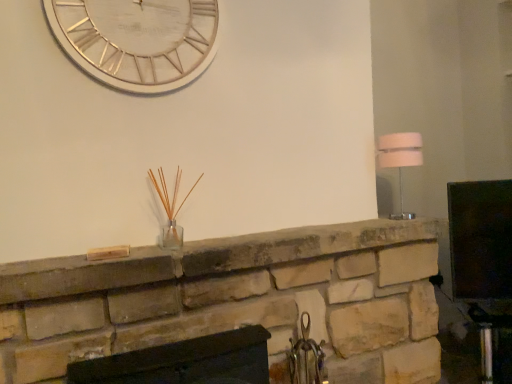
The height and width of the screenshot is (384, 512). I want to click on white fabric lampshade at right, so click(400, 160).

Considering the relative sizes of matte black fireplace at center, the second fireplace positioned from the top, and white fabric lampshade at right in the image provided, is matte black fireplace at center, the second fireplace positioned from the top, smaller than white fabric lampshade at right?

Incorrect, matte black fireplace at center, the second fireplace positioned from the top, is not smaller in size than white fabric lampshade at right.

From the image's perspective, would you say matte black fireplace at center, positioned as the 1th fireplace in bottom-to-top order, is positioned over white fabric lampshade at right?

No, from the image's perspective, matte black fireplace at center, positioned as the 1th fireplace in bottom-to-top order, is not on top of white fabric lampshade at right.

Is matte black fireplace at center, the second fireplace positioned from the top, spatially inside white fabric lampshade at right, or outside of it?

matte black fireplace at center, the second fireplace positioned from the top, lies outside white fabric lampshade at right.

Between matte black fireplace at center, the second fireplace positioned from the top, and natural stone fireplace at center, which is the 2th fireplace in bottom-to-top order, which one has smaller size?

matte black fireplace at center, the second fireplace positioned from the top, is smaller.

From their relative heights in the image, would you say matte black fireplace at center, the second fireplace positioned from the top, is taller or shorter than natural stone fireplace at center, which is the 2th fireplace in bottom-to-top order?

matte black fireplace at center, the second fireplace positioned from the top, is taller than natural stone fireplace at center, which is the 2th fireplace in bottom-to-top order.

Looking at this image, which is correct: matte black fireplace at center, the second fireplace positioned from the top, is inside natural stone fireplace at center, arranged as the 1th fireplace when viewed from the top, or outside of it?

matte black fireplace at center, the second fireplace positioned from the top, lies outside natural stone fireplace at center, arranged as the 1th fireplace when viewed from the top.

Between matte black fireplace at center, positioned as the 1th fireplace in bottom-to-top order, and natural stone fireplace at center, arranged as the 1th fireplace when viewed from the top, which one has smaller width?

Thinner between the two is matte black fireplace at center, positioned as the 1th fireplace in bottom-to-top order.

In terms of width, does white metallic clock at upper center look wider or thinner when compared to white fabric lampshade at right?

Considering their sizes, white metallic clock at upper center looks slimmer than white fabric lampshade at right.

Does white metallic clock at upper center appear on the right side of white fabric lampshade at right?

In fact, white metallic clock at upper center is to the left of white fabric lampshade at right.

Looking at this image, does white metallic clock at upper center contain white fabric lampshade at right?

No.

From a real-world perspective, which is physically above, white metallic clock at upper center or white fabric lampshade at right?

In real-world perspective, white metallic clock at upper center is above.

From a real-world perspective, does white metallic clock at upper center sit lower than matte black fireplace at center, positioned as the 1th fireplace in bottom-to-top order?

No, from a real-world perspective, white metallic clock at upper center is not under matte black fireplace at center, positioned as the 1th fireplace in bottom-to-top order.

From the image's perspective, which is below, white metallic clock at upper center or matte black fireplace at center, positioned as the 1th fireplace in bottom-to-top order?

matte black fireplace at center, positioned as the 1th fireplace in bottom-to-top order, appears lower in the image.

Would you say white metallic clock at upper center is to the left or to the right of matte black fireplace at center, the second fireplace positioned from the top, in the picture?

Based on their positions, white metallic clock at upper center is located to the left of matte black fireplace at center, the second fireplace positioned from the top.

Is the position of white metallic clock at upper center more distant than that of matte black fireplace at center, the second fireplace positioned from the top?

Yes, white metallic clock at upper center is further from the camera.

Who is shorter, white metallic clock at upper center or natural stone fireplace at center, arranged as the 1th fireplace when viewed from the top?

natural stone fireplace at center, arranged as the 1th fireplace when viewed from the top, is shorter.

From the image's perspective, count 1st fireplaces downward from the white metallic clock at upper center and point to it. Please provide its 2D coordinates.

[(234, 300)]

Consider the image. From the image's perspective, is white metallic clock at upper center over natural stone fireplace at center, which is the 2th fireplace in bottom-to-top order?

Indeed, from the image's perspective, white metallic clock at upper center is shown above natural stone fireplace at center, which is the 2th fireplace in bottom-to-top order.

Is white metallic clock at upper center next to natural stone fireplace at center, arranged as the 1th fireplace when viewed from the top, and touching it?

No, white metallic clock at upper center is not beside natural stone fireplace at center, arranged as the 1th fireplace when viewed from the top.

Can you confirm if white fabric lampshade at right is positioned to the right of matte black fireplace at center, the second fireplace positioned from the top?

Correct, you'll find white fabric lampshade at right to the right of matte black fireplace at center, the second fireplace positioned from the top.

Can you confirm if white fabric lampshade at right is smaller than matte black fireplace at center, the second fireplace positioned from the top?

Yes, white fabric lampshade at right is smaller than matte black fireplace at center, the second fireplace positioned from the top.

From a real-world perspective, between white fabric lampshade at right and matte black fireplace at center, positioned as the 1th fireplace in bottom-to-top order, who is vertically lower?

From a 3D spatial view, matte black fireplace at center, positioned as the 1th fireplace in bottom-to-top order, is below.

In the image, is white fabric lampshade at right positioned in front of or behind matte black fireplace at center, positioned as the 1th fireplace in bottom-to-top order?

Visually, white fabric lampshade at right is located behind matte black fireplace at center, positioned as the 1th fireplace in bottom-to-top order.

Is the position of white fabric lampshade at right more distant than that of white metallic clock at upper center?

Yes, white fabric lampshade at right is behind white metallic clock at upper center.

Can you confirm if white fabric lampshade at right is shorter than white metallic clock at upper center?

Correct, white fabric lampshade at right is not as tall as white metallic clock at upper center.

Is white fabric lampshade at right positioned with its back to white metallic clock at upper center?

No.

From the image's perspective, count 2nd fireplaces downward from the white fabric lampshade at right and point to it. Please provide its 2D coordinates.

[(184, 362)]

At what (x,y) coordinates should I click in order to perform the action: click on fireplace above the matte black fireplace at center, the second fireplace positioned from the top (from a real-world perspective). Please return your answer as a coordinate pair (x, y). The image size is (512, 384). Looking at the image, I should click on (234, 300).

Looking at the image, which one is located closer to white fabric lampshade at right, white metallic clock at upper center or natural stone fireplace at center, which is the 2th fireplace in bottom-to-top order?

natural stone fireplace at center, which is the 2th fireplace in bottom-to-top order.

Which object lies further to the anchor point natural stone fireplace at center, arranged as the 1th fireplace when viewed from the top, white fabric lampshade at right or white metallic clock at upper center?

Among the two, white metallic clock at upper center is located further to natural stone fireplace at center, arranged as the 1th fireplace when viewed from the top.

Looking at the image, which one is located closer to white fabric lampshade at right, natural stone fireplace at center, which is the 2th fireplace in bottom-to-top order, or white metallic clock at upper center?

The object closer to white fabric lampshade at right is natural stone fireplace at center, which is the 2th fireplace in bottom-to-top order.

From the picture: Which object lies further to the anchor point natural stone fireplace at center, which is the 2th fireplace in bottom-to-top order, matte black fireplace at center, the second fireplace positioned from the top, or white fabric lampshade at right?

The object further to natural stone fireplace at center, which is the 2th fireplace in bottom-to-top order, is white fabric lampshade at right.

Which object lies further to the anchor point matte black fireplace at center, positioned as the 1th fireplace in bottom-to-top order, white metallic clock at upper center or white fabric lampshade at right?

Among the two, white fabric lampshade at right is located further to matte black fireplace at center, positioned as the 1th fireplace in bottom-to-top order.

From the image, which object appears to be nearer to white metallic clock at upper center, natural stone fireplace at center, arranged as the 1th fireplace when viewed from the top, or white fabric lampshade at right?

natural stone fireplace at center, arranged as the 1th fireplace when viewed from the top.

In the scene shown: Based on their spatial positions, is white fabric lampshade at right or matte black fireplace at center, the second fireplace positioned from the top, closer to natural stone fireplace at center, which is the 2th fireplace in bottom-to-top order?

matte black fireplace at center, the second fireplace positioned from the top, is closer to natural stone fireplace at center, which is the 2th fireplace in bottom-to-top order.

From the image, which object appears to be farther from natural stone fireplace at center, arranged as the 1th fireplace when viewed from the top, white metallic clock at upper center or matte black fireplace at center, positioned as the 1th fireplace in bottom-to-top order?

Based on the image, white metallic clock at upper center appears to be further to natural stone fireplace at center, arranged as the 1th fireplace when viewed from the top.

I want to click on fireplace between matte black fireplace at center, the second fireplace positioned from the top, and white fabric lampshade at right from left to right, so click(234, 300).

The image size is (512, 384). I want to click on fireplace between white metallic clock at upper center and matte black fireplace at center, positioned as the 1th fireplace in bottom-to-top order, in the vertical direction, so click(234, 300).